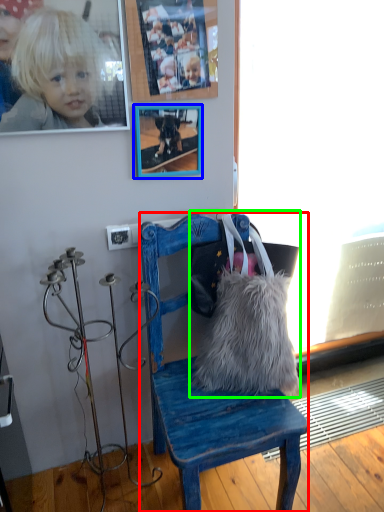
Question: Estimate the real-world distances between objects in this image. Which object is closer to chair (highlighted by a red box), picture frame (highlighted by a blue box) or handbag (highlighted by a green box)?

Choices:
 (A) picture frame
 (B) handbag

Answer: (B)